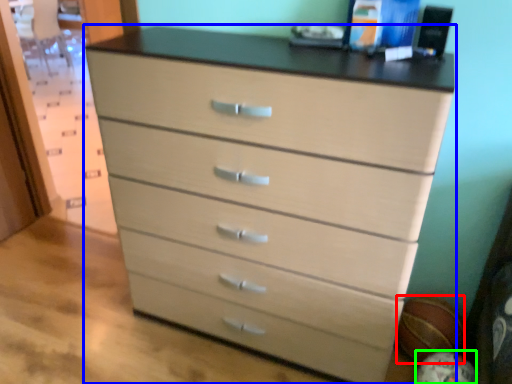
Question: Estimate the real-world distances between objects in this image. Which object is farther from basketball (highlighted by a red box), chest of drawers (highlighted by a blue box) or basketball (highlighted by a green box)?

Choices:
 (A) chest of drawers
 (B) basketball

Answer: (A)